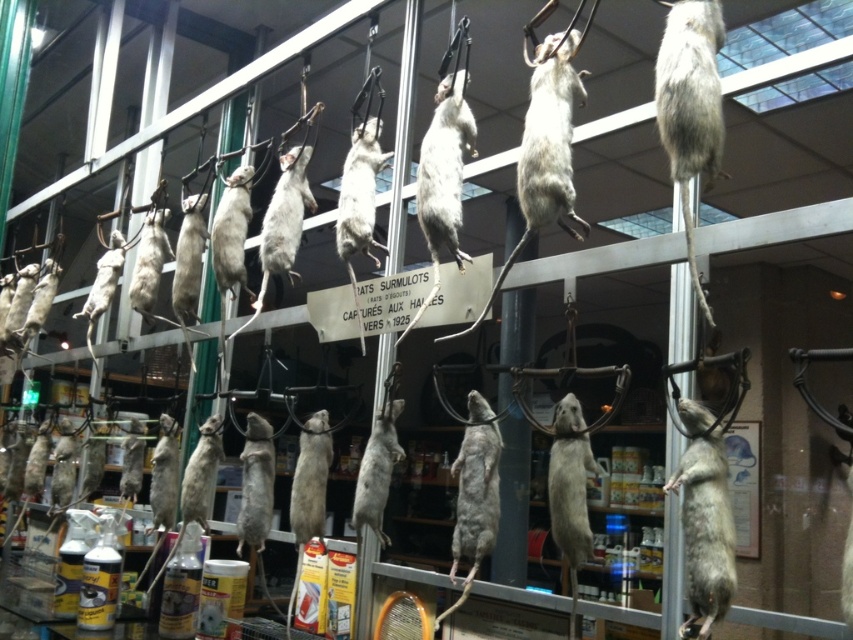
Does gray matte mouse at upper center appear under gray fur mouse at center?

No, gray matte mouse at upper center is not below gray fur mouse at center.

Who is lower down, gray matte mouse at upper center or gray fur mouse at center?

gray fur mouse at center is lower down.

Who is more forward, (x=693, y=106) or (x=370, y=484)?

Positioned in front is point (x=693, y=106).

The height and width of the screenshot is (640, 853). What are the coordinates of `gray matte mouse at upper center` in the screenshot? It's located at (689, 106).

Which is more to the left, fuzzy gray mouse at center or gray fur mouse at center?

Positioned to the left is gray fur mouse at center.

Which of these two, fuzzy gray mouse at center or gray fur mouse at center, stands taller?

gray fur mouse at center

Find the location of a particular element. Image resolution: width=853 pixels, height=640 pixels. fuzzy gray mouse at center is located at coordinates tap(705, 531).

Is gray matte mouse at upper center positioned behind fuzzy gray mouse at center?

Yes, gray matte mouse at upper center is further from the viewer.

What do you see at coordinates (689, 106) in the screenshot? I see `gray matte mouse at upper center` at bounding box center [689, 106].

The width and height of the screenshot is (853, 640). Find the location of `gray matte mouse at upper center`. gray matte mouse at upper center is located at coordinates (689, 106).